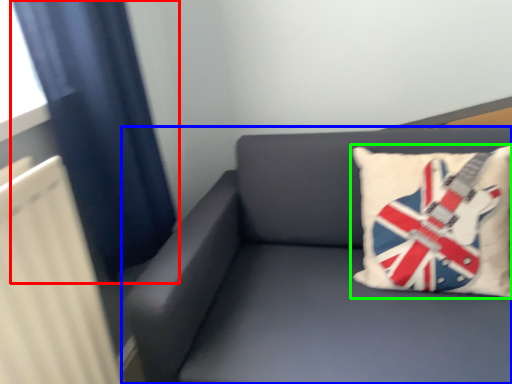
Question: Based on their relative distances, which object is nearer to curtain (highlighted by a red box)? Choose from studio couch (highlighted by a blue box) and pillow (highlighted by a green box).

Choices:
 (A) studio couch
 (B) pillow

Answer: (A)